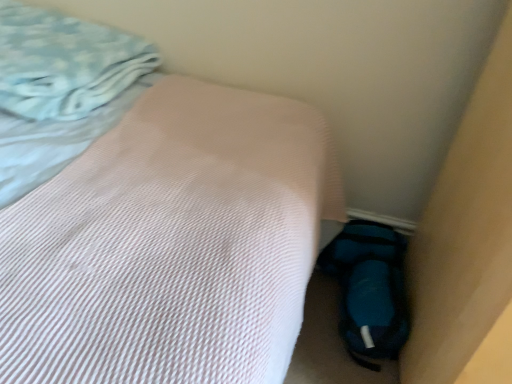
Question: Should I look upward or downward to see light blue textured blanket at upper left?

Choices:
 (A) down
 (B) up

Answer: (B)

Question: From the image's perspective, is light blue textured blanket at upper left located above blue fuzzy sleeping bag at lower right?

Choices:
 (A) yes
 (B) no

Answer: (A)

Question: From a real-world perspective, is light blue textured blanket at upper left physically above blue fuzzy sleeping bag at lower right?

Choices:
 (A) yes
 (B) no

Answer: (A)

Question: Considering the relative sizes of light blue textured blanket at upper left and blue fuzzy sleeping bag at lower right in the image provided, is light blue textured blanket at upper left taller than blue fuzzy sleeping bag at lower right?

Choices:
 (A) no
 (B) yes

Answer: (B)

Question: Can you confirm if light blue textured blanket at upper left is bigger than blue fuzzy sleeping bag at lower right?

Choices:
 (A) no
 (B) yes

Answer: (B)

Question: From the image's perspective, is light blue textured blanket at upper left below blue fuzzy sleeping bag at lower right?

Choices:
 (A) no
 (B) yes

Answer: (A)

Question: Is light blue textured blanket at upper left thinner than blue fuzzy sleeping bag at lower right?

Choices:
 (A) yes
 (B) no

Answer: (B)

Question: Does blue fuzzy sleeping bag at lower right have a lesser height compared to pink textured bed at center?

Choices:
 (A) no
 (B) yes

Answer: (B)

Question: Does blue fuzzy sleeping bag at lower right turn towards pink textured bed at center?

Choices:
 (A) yes
 (B) no

Answer: (B)

Question: From the image's perspective, is blue fuzzy sleeping bag at lower right beneath pink textured bed at center?

Choices:
 (A) no
 (B) yes

Answer: (B)

Question: Considering the relative sizes of blue fuzzy sleeping bag at lower right and pink textured bed at center in the image provided, is blue fuzzy sleeping bag at lower right bigger than pink textured bed at center?

Choices:
 (A) no
 (B) yes

Answer: (A)

Question: Can we say blue fuzzy sleeping bag at lower right lies outside pink textured bed at center?

Choices:
 (A) no
 (B) yes

Answer: (B)

Question: Considering the relative sizes of blue fuzzy sleeping bag at lower right and pink textured bed at center in the image provided, is blue fuzzy sleeping bag at lower right smaller than pink textured bed at center?

Choices:
 (A) yes
 (B) no

Answer: (A)

Question: Can you confirm if pink textured bed at center is thinner than light blue textured blanket at upper left?

Choices:
 (A) yes
 (B) no

Answer: (B)